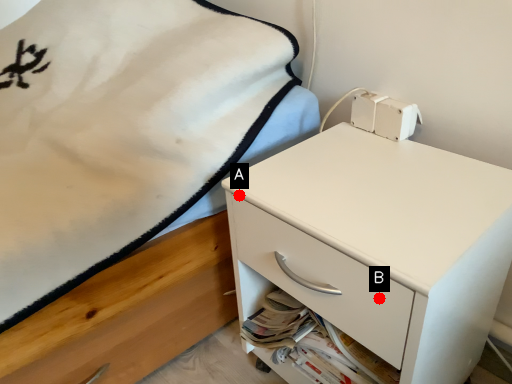
Question: Two points are circled on the image, labeled by A and B beside each circle. Among these points, which one is farthest from the camera?

Choices:
 (A) A is further
 (B) B is further

Answer: (A)